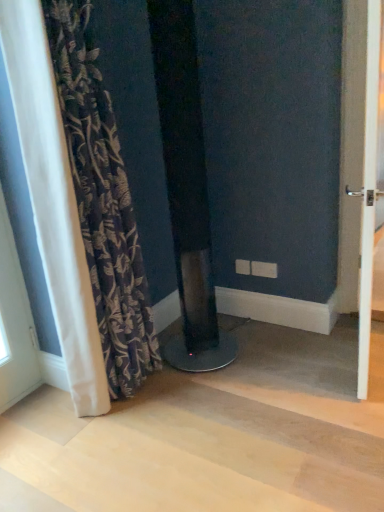
Identify the location of vacant space in front of dark floral fabric curtain at left. click(x=107, y=448).